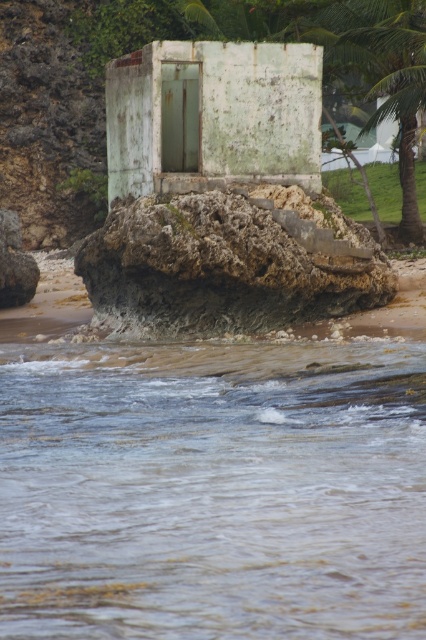
Question: Can you confirm if rusty metal hut at center is positioned to the right of green leafy palm tree at upper right?

Choices:
 (A) no
 (B) yes

Answer: (A)

Question: Can you confirm if muddy water at lower center is positioned to the left of green leafy palm tree at upper right?

Choices:
 (A) yes
 (B) no

Answer: (A)

Question: Which point is farther to the camera?

Choices:
 (A) (224, 556)
 (B) (351, 67)

Answer: (B)

Question: Is rusty concrete rock at center positioned behind rusty metal hut at center?

Choices:
 (A) yes
 (B) no

Answer: (B)

Question: Which object appears closest to the camera in this image?

Choices:
 (A) muddy water at lower center
 (B) rusty concrete rock at center

Answer: (A)

Question: Which of the following is the farthest from the observer?

Choices:
 (A) (175, 636)
 (B) (98, 307)

Answer: (B)